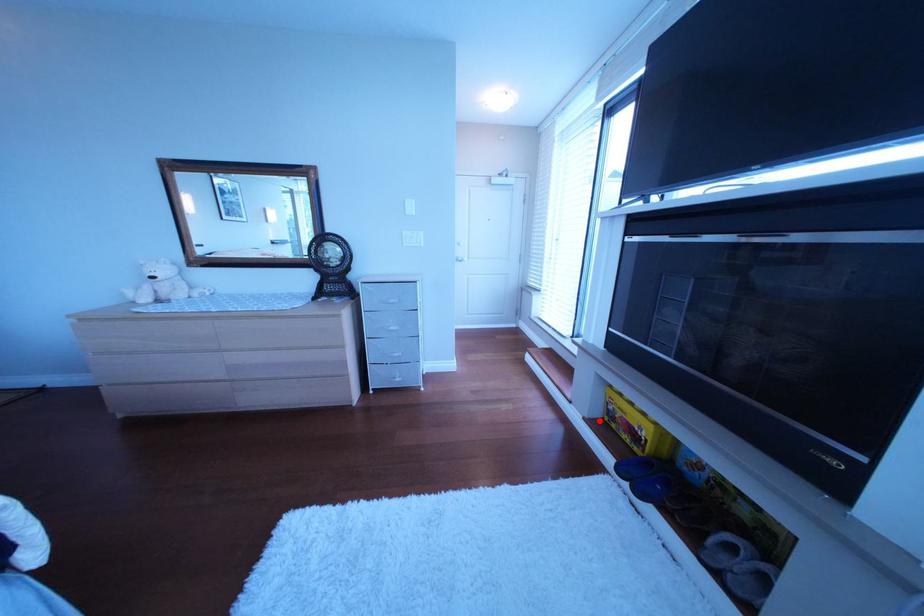
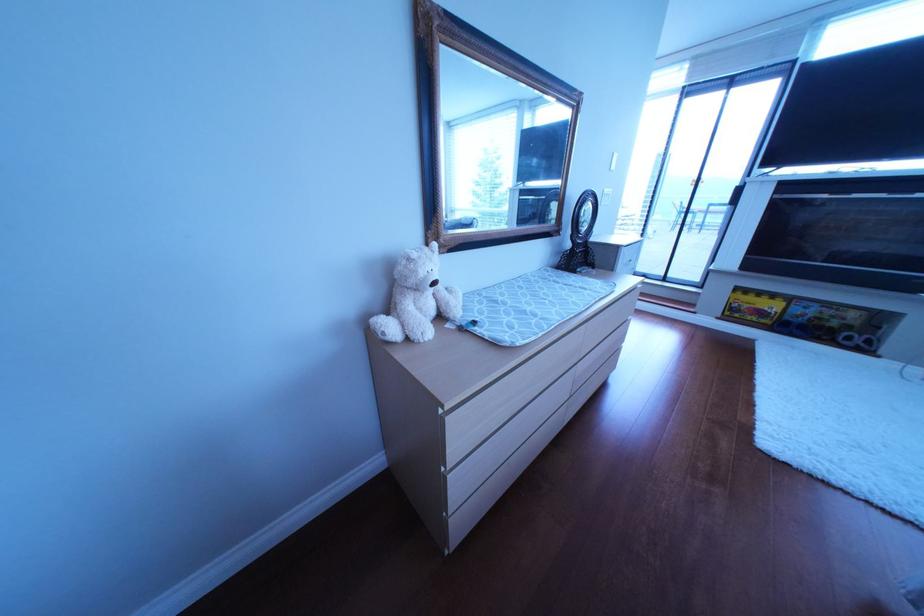
Find the pixel in the second image that matches the highlighted location in the first image.

(733, 320)